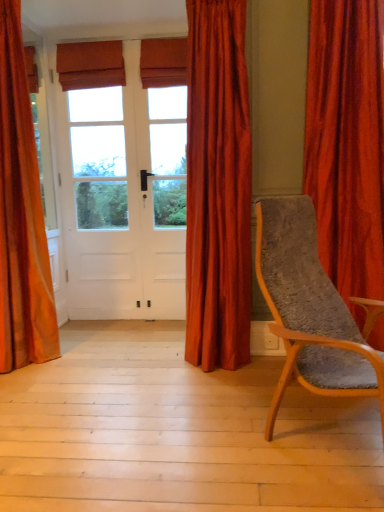
This screenshot has height=512, width=384. In order to click on blank space situated above white wood screen door at center (from a real-world perspective) in this screenshot , I will do `click(92, 40)`.